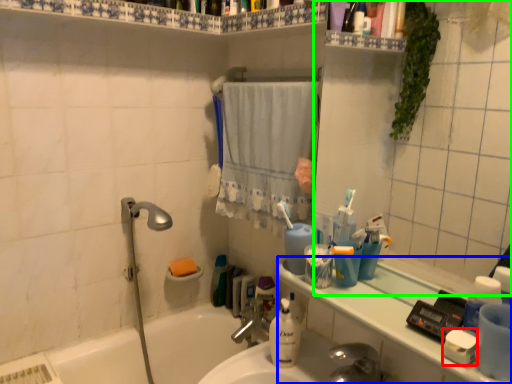
Question: Based on their relative distances, which object is farther from soap (highlighted by a red box)? Choose from counter top (highlighted by a blue box) and mirror (highlighted by a green box).

Choices:
 (A) counter top
 (B) mirror

Answer: (B)